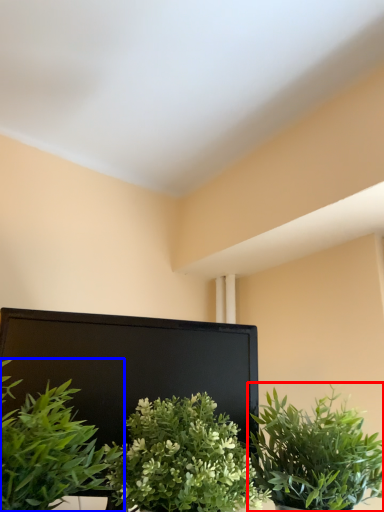
Question: Which object appears farthest to the camera in this image, houseplant (highlighted by a red box) or houseplant (highlighted by a blue box)?

Choices:
 (A) houseplant
 (B) houseplant

Answer: (A)